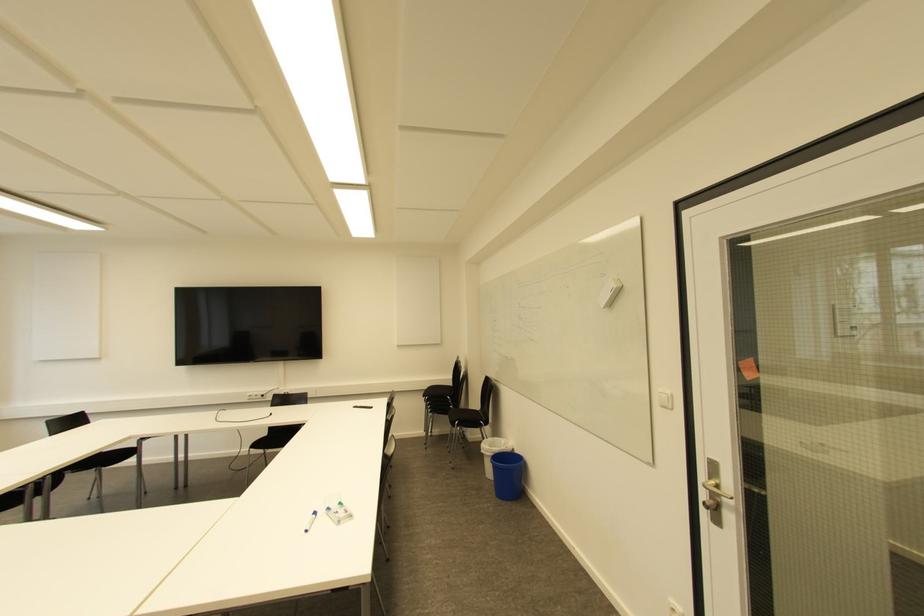
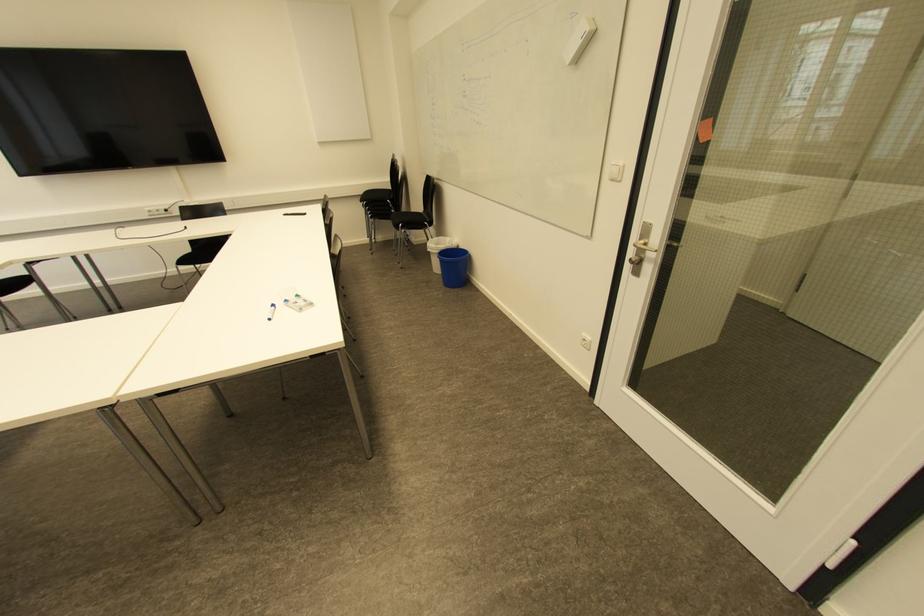
Where in the second image is the point corresponding to pixel 256 444 from the first image?

(183, 261)